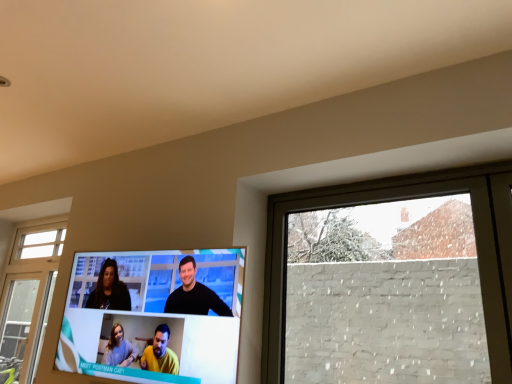
Question: Considering the positions of white brick wall at right and matte black television at center in the image, is white brick wall at right bigger or smaller than matte black television at center?

Choices:
 (A) big
 (B) small

Answer: (B)

Question: From the image's perspective, is white brick wall at right positioned above or below matte black television at center?

Choices:
 (A) below
 (B) above

Answer: (B)

Question: From a real-world perspective, is white brick wall at right above or below matte black television at center?

Choices:
 (A) above
 (B) below

Answer: (A)

Question: Does point (112, 309) appear closer or farther from the camera than point (355, 195)?

Choices:
 (A) farther
 (B) closer

Answer: (B)

Question: Considering the positions of matte black television at center and white brick wall at right in the image, is matte black television at center wider or thinner than white brick wall at right?

Choices:
 (A) wide
 (B) thin

Answer: (A)

Question: From the image's perspective, is matte black television at center located above or below white brick wall at right?

Choices:
 (A) above
 (B) below

Answer: (B)

Question: Considering their positions, is matte black television at center located in front of or behind white brick wall at right?

Choices:
 (A) front
 (B) behind

Answer: (B)